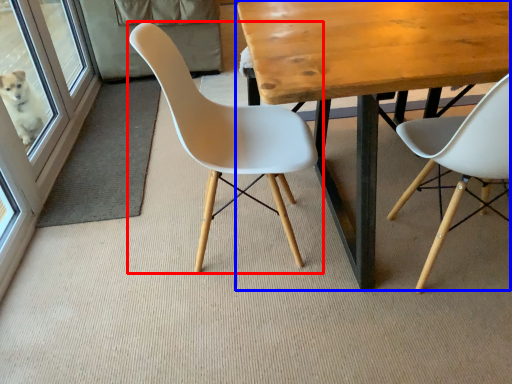
Question: Among these objects, which one is nearest to the camera, chair (highlighted by a red box) or table (highlighted by a blue box)?

Choices:
 (A) chair
 (B) table

Answer: (B)